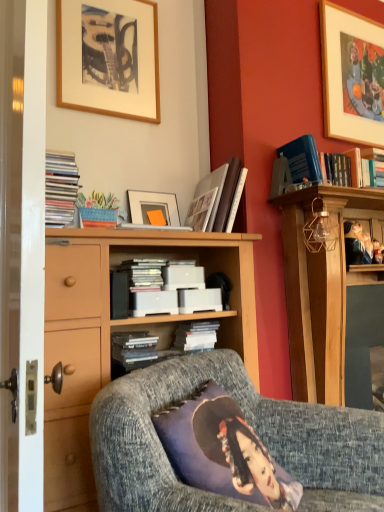
Question: Is wooden cabinet at center at the left side of matte black books at left, the second book viewed from the top?

Choices:
 (A) no
 (B) yes

Answer: (A)

Question: Is wooden cabinet at center bigger than matte black books at left, the first book positioned from the left?

Choices:
 (A) yes
 (B) no

Answer: (A)

Question: From a real-world perspective, is wooden cabinet at center below matte black books at left, the third book from the bottom?

Choices:
 (A) no
 (B) yes

Answer: (B)

Question: Is wooden cabinet at center aimed at matte black books at left, the second book viewed from the top?

Choices:
 (A) no
 (B) yes

Answer: (A)

Question: Is wooden cabinet at center outside matte black books at left, which ranks as the fourth book in right-to-left order?

Choices:
 (A) no
 (B) yes

Answer: (B)

Question: Can you confirm if wooden cabinet at center is shorter than matte black books at left, which ranks as the fourth book in right-to-left order?

Choices:
 (A) no
 (B) yes

Answer: (A)

Question: Is matte black books at left, which ranks as the fourth book in right-to-left order, positioned in front of white matte book at center, the second book from the right?

Choices:
 (A) yes
 (B) no

Answer: (A)

Question: Considering the relative sizes of matte black books at left, the third book from the bottom, and white matte book at center, which is counted as the 3th book, starting from the top, in the image provided, is matte black books at left, the third book from the bottom, shorter than white matte book at center, which is counted as the 3th book, starting from the top,?

Choices:
 (A) no
 (B) yes

Answer: (A)

Question: From a real-world perspective, is matte black books at left, the third book from the bottom, positioned over white matte book at center, which appears as the third book when viewed from the left, based on gravity?

Choices:
 (A) no
 (B) yes

Answer: (B)

Question: Is matte black books at left, the second book viewed from the top, to the left of white matte book at center, which appears as the third book when viewed from the left, from the viewer's perspective?

Choices:
 (A) no
 (B) yes

Answer: (B)

Question: Considering the relative sizes of matte black books at left, which ranks as the fourth book in right-to-left order, and white matte book at center, the second book from the right, in the image provided, is matte black books at left, which ranks as the fourth book in right-to-left order, taller than white matte book at center, the second book from the right,?

Choices:
 (A) yes
 (B) no

Answer: (A)

Question: From a real-world perspective, is matte black books at left, the third book from the bottom, beneath white matte book at center, the second book ordered from the bottom?

Choices:
 (A) yes
 (B) no

Answer: (B)

Question: Can you confirm if white matte book at center, which is the 4th book in top-to-bottom order, is wider than smooth wooden frame at upper right, which is counted as the second person, starting from the right?

Choices:
 (A) no
 (B) yes

Answer: (B)